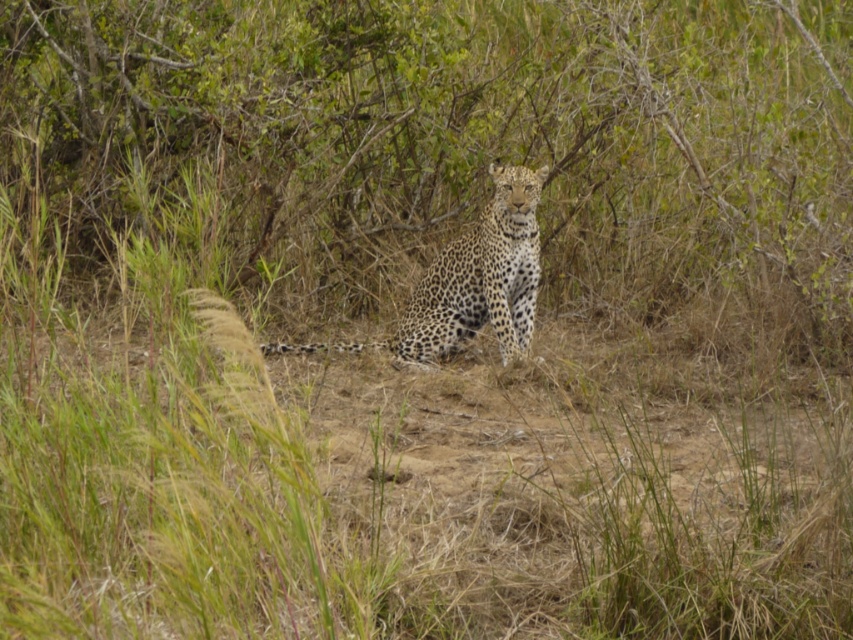
Question: Is green leafy bush at center positioned behind spotted fur leopard at center?

Choices:
 (A) no
 (B) yes

Answer: (A)

Question: Is the position of green leafy bush at center more distant than that of spotted fur leopard at center?

Choices:
 (A) no
 (B) yes

Answer: (A)

Question: Among these objects, which one is nearest to the camera?

Choices:
 (A) spotted fur leopard at center
 (B) green leafy bush at center

Answer: (B)

Question: Observing the image, what is the correct spatial positioning of green leafy bush at center in reference to spotted fur leopard at center?

Choices:
 (A) above
 (B) below

Answer: (A)

Question: Which point appears farthest from the camera in this image?

Choices:
 (A) (440, 276)
 (B) (746, 109)

Answer: (B)